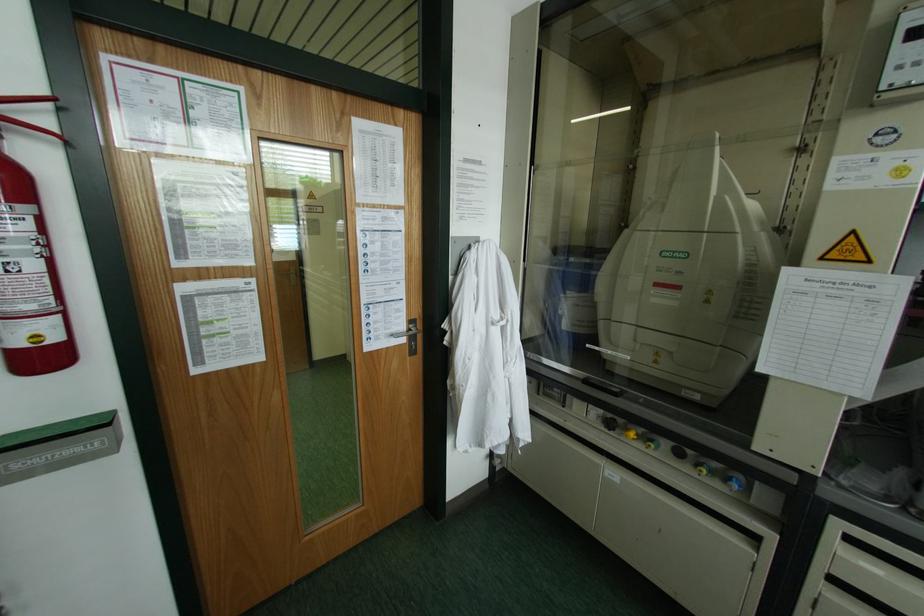
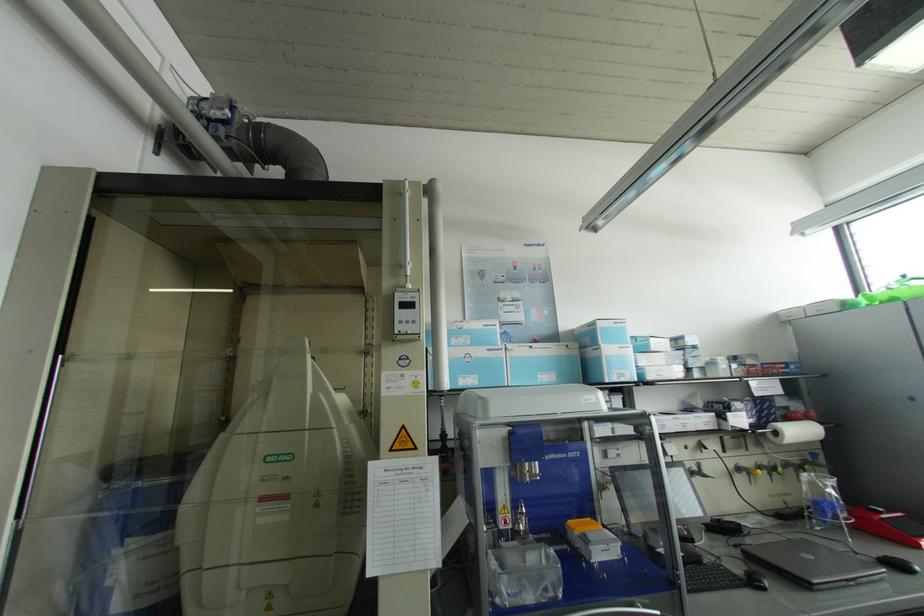
First-person continuous shooting, in which direction is the camera rotating?

The camera rotated toward right-up.